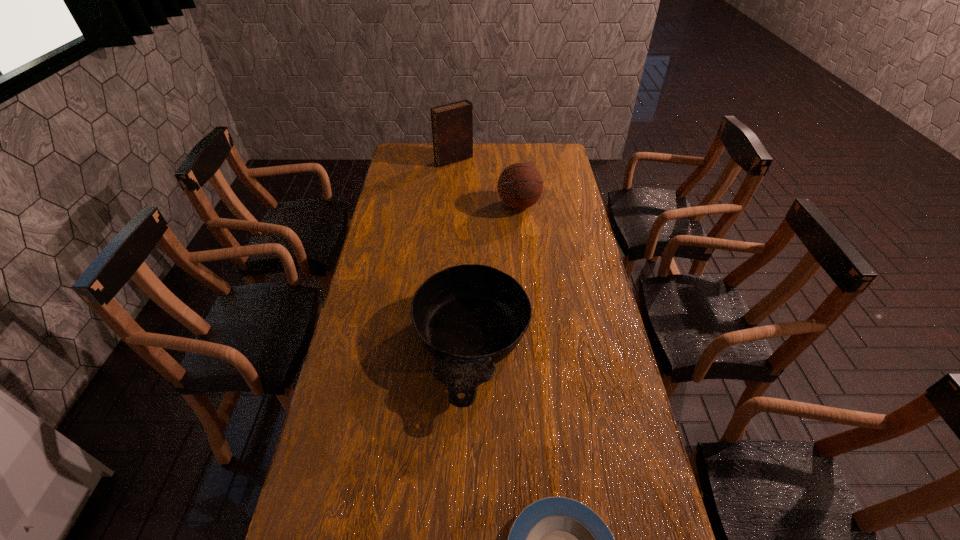
Find the location of a particular element. the tallest object is located at coordinates coord(452,124).

You are a GUI agent. You are given a task and a screenshot of the screen. Output one action in this format:
    pyautogui.click(x=<x>, y=<y>)
    Task: Click on the Bible
    The height and width of the screenshot is (540, 960).
    Given the screenshot: What is the action you would take?
    point(452,124)

Find the location of a particular element. The width and height of the screenshot is (960, 540). the second tallest object is located at coordinates (520, 185).

This screenshot has width=960, height=540. I want to click on the third nearest object, so click(x=520, y=185).

At what (x,y) coordinates should I click in order to perform the action: click on frying pan. Please return your answer as a coordinate pair (x, y). This screenshot has height=540, width=960. Looking at the image, I should click on (471, 316).

Locate an element on the screen. This screenshot has width=960, height=540. the third tallest object is located at coordinates (471, 316).

At what (x,y) coordinates should I click in order to perform the action: click on free spot located 0.140m on the right of the Bible. Please return your answer as a coordinate pair (x, y). Looking at the image, I should click on (501, 160).

At what (x,y) coordinates should I click in order to perform the action: click on blank space located on the side with brand label of the second tallest object. Please return your answer as a coordinate pair (x, y). The image size is (960, 540). Looking at the image, I should click on (525, 266).

Identify the location of free region located with the handle extending from the side of the second nearest object. (468, 497).

This screenshot has width=960, height=540. I want to click on object situated at the far edge, so click(452, 124).